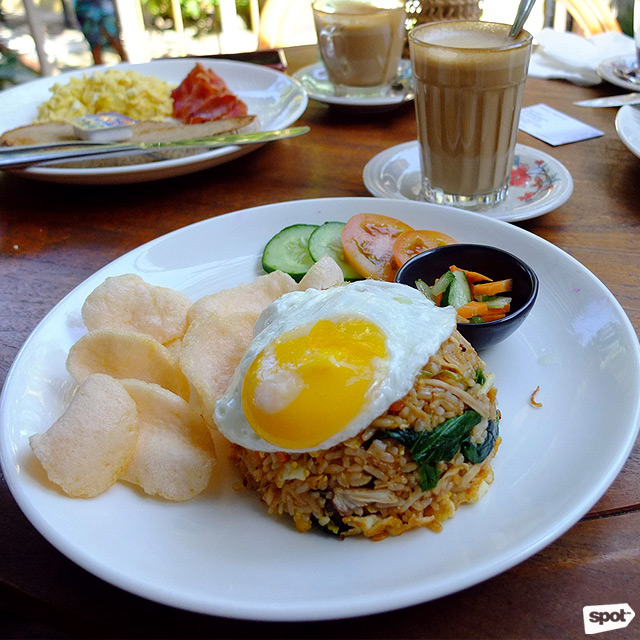
Image resolution: width=640 pixels, height=640 pixels. In order to click on white plate in this screenshot , I will do `click(534, 205)`, `click(403, 184)`, `click(358, 98)`, `click(623, 123)`, `click(265, 102)`, `click(192, 240)`, `click(194, 522)`, `click(569, 355)`, `click(568, 434)`.